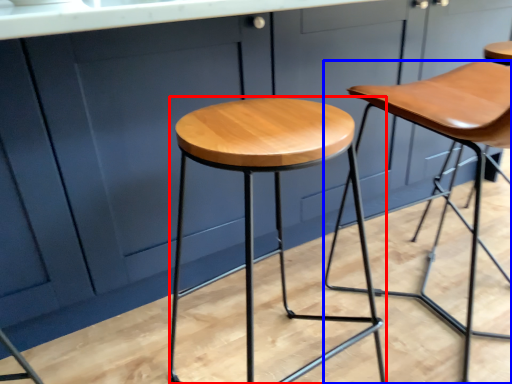
Question: Which object appears farthest to the camera in this image, stool (highlighted by a red box) or stool (highlighted by a blue box)?

Choices:
 (A) stool
 (B) stool

Answer: (B)